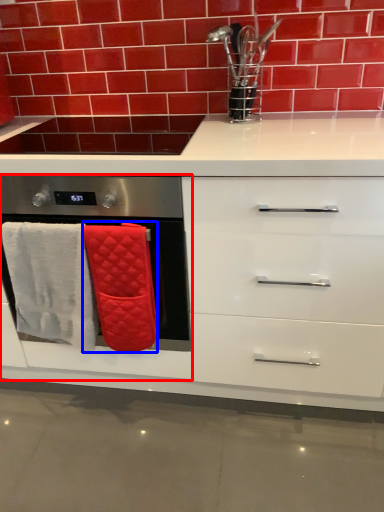
Question: Which point is closer to the camera, oven (highlighted by a red box) or bath towel (highlighted by a blue box)?

Choices:
 (A) oven
 (B) bath towel

Answer: (A)